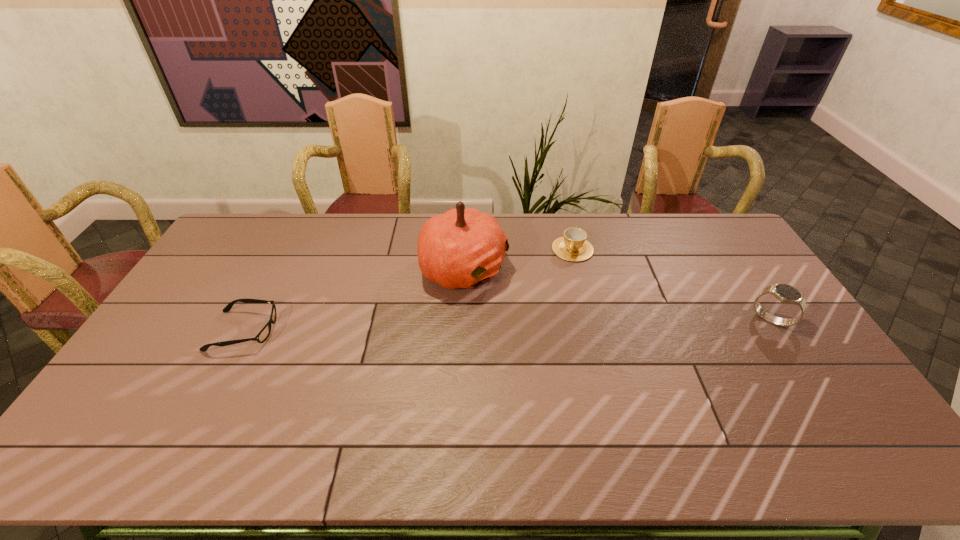
Locate an element on the screen. The image size is (960, 540). free spot between the watch and the cup is located at coordinates (672, 285).

Identify the location of empty space that is in between the rightmost object and the third object from right to left. This screenshot has height=540, width=960. (617, 294).

Where is `vacant space that's between the tallest object and the third shortest object`? This screenshot has width=960, height=540. vacant space that's between the tallest object and the third shortest object is located at coordinates (617, 294).

At what (x,y) coordinates should I click in order to perform the action: click on vacant space that's between the shortest object and the tallest object. Please return your answer as a coordinate pair (x, y). Looking at the image, I should click on (354, 300).

Locate which object is the closest to the second object from left to right. Please provide its 2D coordinates. Your answer should be formatted as a tuple, i.e. [(x, y)], where the tuple contains the x and y coordinates of a point satisfying the conditions above.

[(573, 246)]

Identify which object is the second nearest to the second shortest object. Please provide its 2D coordinates. Your answer should be formatted as a tuple, i.e. [(x, y)], where the tuple contains the x and y coordinates of a point satisfying the conditions above.

[(785, 293)]

This screenshot has width=960, height=540. Find the location of `vacant area in the image that satisfies the following two spatial constraints: 1. on the back side of the tallest object; 2. on the right side of the third object from left to right`. vacant area in the image that satisfies the following two spatial constraints: 1. on the back side of the tallest object; 2. on the right side of the third object from left to right is located at coordinates (465, 249).

You are a GUI agent. You are given a task and a screenshot of the screen. Output one action in this format:
    pyautogui.click(x=<x>, y=<y>)
    Task: Click on the vacant space that satisfies the following two spatial constraints: 1. on the back side of the cup; 2. on the left side of the tallest object
    The width and height of the screenshot is (960, 540).
    Given the screenshot: What is the action you would take?
    pyautogui.click(x=465, y=249)